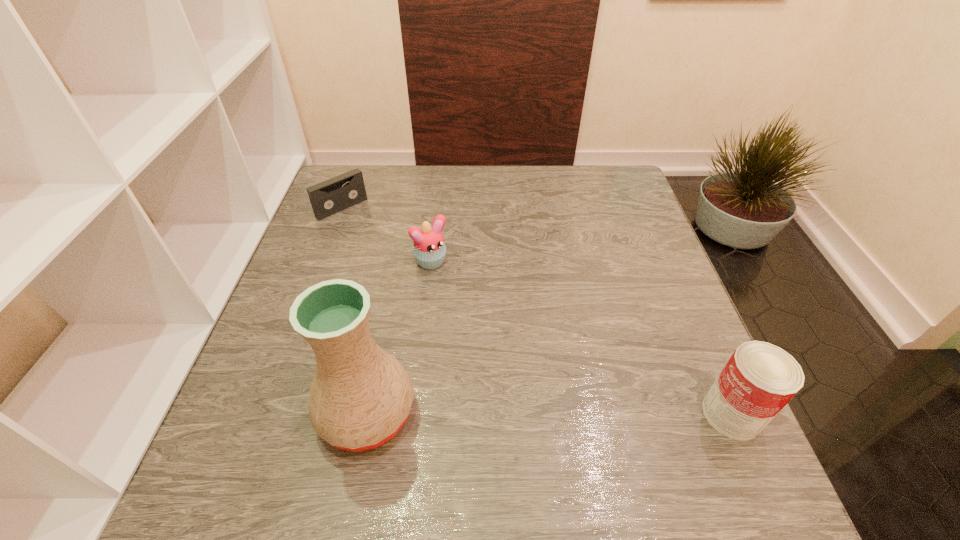
Identify the location of vacant space that is in between the second tallest object and the pottery. (549, 414).

Locate an element on the screen. vacant area that lies between the videotape and the second farthest object is located at coordinates [x=388, y=235].

Where is `free space between the second tallest object and the videotape`? Image resolution: width=960 pixels, height=540 pixels. free space between the second tallest object and the videotape is located at coordinates (537, 311).

Where is `empty space between the second shortest object and the third shortest object`? The height and width of the screenshot is (540, 960). empty space between the second shortest object and the third shortest object is located at coordinates (583, 339).

In order to click on vacant space that is in between the can and the tallest object in this screenshot , I will do `click(549, 414)`.

Find the location of a particular element. This screenshot has width=960, height=540. free space that is in between the pottery and the second tallest object is located at coordinates (549, 414).

The width and height of the screenshot is (960, 540). In order to click on free space between the farthest object and the third nearest object in this screenshot , I will do `click(388, 235)`.

The height and width of the screenshot is (540, 960). What are the coordinates of `object that is the second nearest to the shortest object` in the screenshot? It's located at (360, 397).

The height and width of the screenshot is (540, 960). Identify the location of the closest object to the second farthest object. (x=329, y=197).

At what (x,y) coordinates should I click in order to perform the action: click on vacant space that satisfies the following two spatial constraints: 1. on the front side of the second farthest object; 2. on the right side of the farthest object. Please return your answer as a coordinate pair (x, y). The height and width of the screenshot is (540, 960). Looking at the image, I should click on click(322, 263).